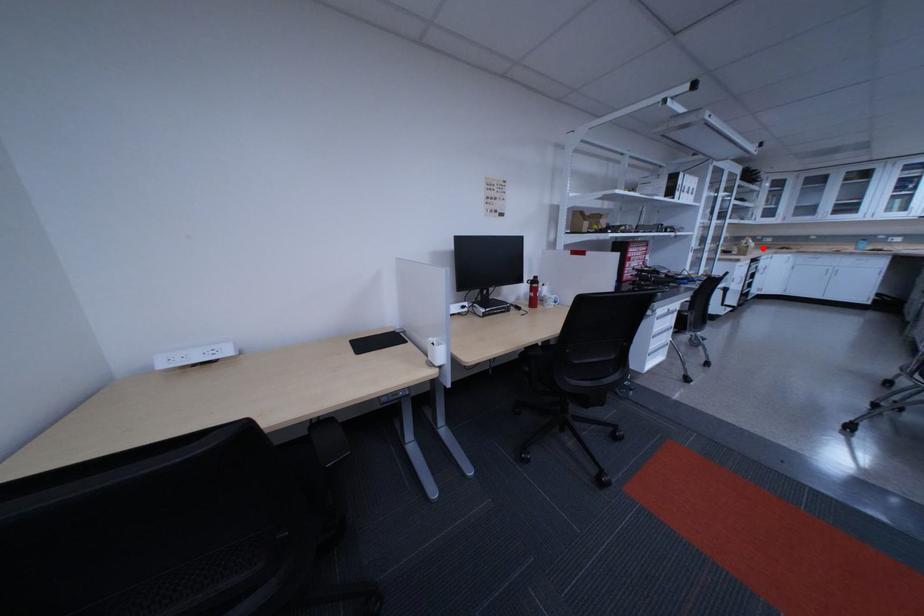
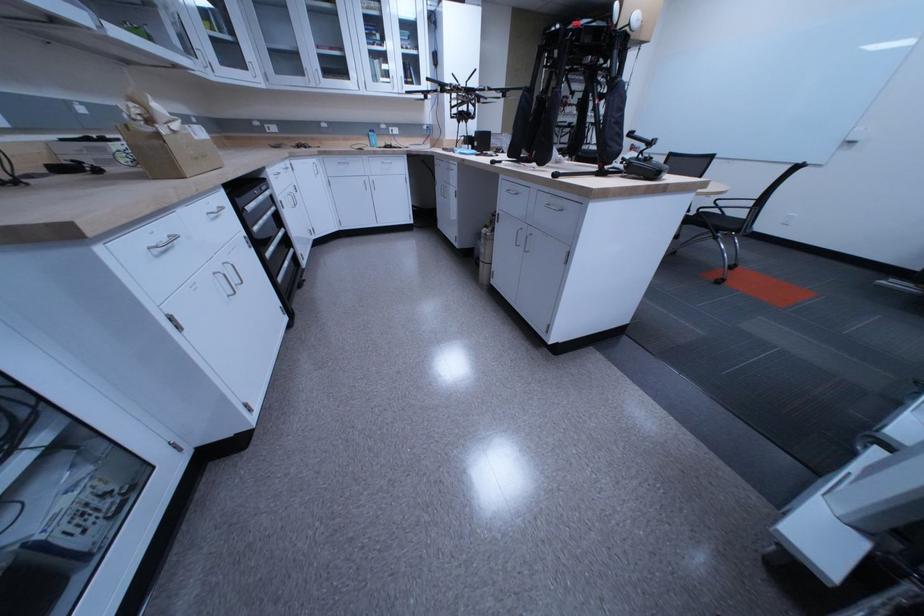
The point at the highlighted location is marked in the first image. Where is the corresponding point in the second image?

(174, 137)